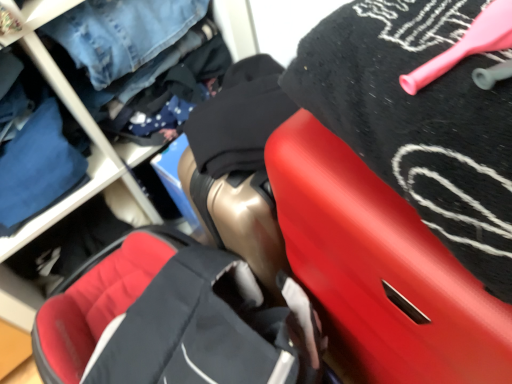
The image size is (512, 384). What do you see at coordinates (419, 120) in the screenshot?
I see `black matte towel at upper right, arranged as the 2th clothing when viewed from the left` at bounding box center [419, 120].

Image resolution: width=512 pixels, height=384 pixels. What do you see at coordinates (175, 320) in the screenshot?
I see `soft fabric baby carriage at center` at bounding box center [175, 320].

Where is `blue denim jeans at upper left, which ranks as the 1th clothing in back-to-front order`? This screenshot has width=512, height=384. blue denim jeans at upper left, which ranks as the 1th clothing in back-to-front order is located at coordinates (36, 167).

What are the coordinates of `black matte towel at upper right, which is the first clothing from right to left` in the screenshot? It's located at (419, 120).

Considering the sizes of objects rubberized red suitcase at upper right and black matte towel at upper right, which is counted as the first clothing, starting from the front, in the image provided, who is smaller, rubberized red suitcase at upper right or black matte towel at upper right, which is counted as the first clothing, starting from the front,?

With smaller size is black matte towel at upper right, which is counted as the first clothing, starting from the front.

Are rubberized red suitcase at upper right and black matte towel at upper right, which is the first clothing from right to left, far apart?

No, rubberized red suitcase at upper right is not far from black matte towel at upper right, which is the first clothing from right to left.

Which of these two, rubberized red suitcase at upper right or black matte towel at upper right, the second clothing when ordered from back to front, is wider?

Wider between the two is rubberized red suitcase at upper right.

Is rubberized red suitcase at upper right oriented towards black matte towel at upper right, which is counted as the first clothing, starting from the front?

No, rubberized red suitcase at upper right is not turned towards black matte towel at upper right, which is counted as the first clothing, starting from the front.

Between black matte towel at upper right, which is the first clothing from right to left, and blue denim jeans at upper left, which ranks as the 1th clothing in back-to-front order, which one is positioned behind?

blue denim jeans at upper left, which ranks as the 1th clothing in back-to-front order.

From the image's perspective, is black matte towel at upper right, which is the first clothing from right to left, positioned above or below blue denim jeans at upper left, the second clothing in the front-to-back sequence?

black matte towel at upper right, which is the first clothing from right to left, is situated lower than blue denim jeans at upper left, the second clothing in the front-to-back sequence, in the image.

From a real-world perspective, who is located lower, black matte towel at upper right, which is counted as the first clothing, starting from the front, or blue denim jeans at upper left, which ranks as the 1th clothing in back-to-front order?

blue denim jeans at upper left, which ranks as the 1th clothing in back-to-front order, from a real-world perspective.

Are black matte towel at upper right, which is the first clothing from right to left, and blue denim jeans at upper left, which is the 2th clothing from right to left, located far from each other?

black matte towel at upper right, which is the first clothing from right to left, is actually quite close to blue denim jeans at upper left, which is the 2th clothing from right to left.

Does blue denim jeans at upper left, which is the 2th clothing from right to left, turn towards soft fabric baby carriage at center?

No, blue denim jeans at upper left, which is the 2th clothing from right to left, is not facing towards soft fabric baby carriage at center.

In terms of width, does blue denim jeans at upper left, the second clothing in the front-to-back sequence, look wider or thinner when compared to soft fabric baby carriage at center?

Considering their sizes, blue denim jeans at upper left, the second clothing in the front-to-back sequence, looks slimmer than soft fabric baby carriage at center.

How many degrees apart are the facing directions of blue denim jeans at upper left, which ranks as the 1th clothing in back-to-front order, and soft fabric baby carriage at center?

82.2 degrees separate the facing orientations of blue denim jeans at upper left, which ranks as the 1th clothing in back-to-front order, and soft fabric baby carriage at center.

How distant is blue denim jeans at upper left, the second clothing in the front-to-back sequence, from soft fabric baby carriage at center?

A distance of 12.65 inches exists between blue denim jeans at upper left, the second clothing in the front-to-back sequence, and soft fabric baby carriage at center.

Does soft fabric baby carriage at center turn towards blue denim jeans at upper left, the second clothing in the front-to-back sequence?

No, soft fabric baby carriage at center is not facing towards blue denim jeans at upper left, the second clothing in the front-to-back sequence.

Who is smaller, soft fabric baby carriage at center or blue denim jeans at upper left, which ranks as the 1th clothing in back-to-front order?

Smaller between the two is blue denim jeans at upper left, which ranks as the 1th clothing in back-to-front order.

From the picture: Which point is more distant from viewer, [178,297] or [12,200]?

Point [12,200]

From the picture: Is rubberized red suitcase at upper right in front of or behind blue denim jeans at upper left, the second clothing in the front-to-back sequence, in the image?

Clearly, rubberized red suitcase at upper right is in front of blue denim jeans at upper left, the second clothing in the front-to-back sequence.

From the image's perspective, is rubberized red suitcase at upper right located above or below blue denim jeans at upper left, which is the 2th clothing from right to left?

rubberized red suitcase at upper right is below blue denim jeans at upper left, which is the 2th clothing from right to left.

How distant is rubberized red suitcase at upper right from blue denim jeans at upper left, which ranks as the 1th clothing in back-to-front order?

23.49 inches.

Does rubberized red suitcase at upper right have a lesser height compared to blue denim jeans at upper left, which is the 2th clothing from right to left?

No, rubberized red suitcase at upper right is not shorter than blue denim jeans at upper left, which is the 2th clothing from right to left.

From the image's perspective, between blue denim jeans at upper left, which ranks as the 1th clothing in back-to-front order, and rubberized red suitcase at upper right, who is located below?

rubberized red suitcase at upper right is shown below in the image.

Considering the points (16, 94) and (379, 309), which point is in front, point (16, 94) or point (379, 309)?

The point (379, 309) is in front.

Considering the relative sizes of blue denim jeans at upper left, the second clothing in the front-to-back sequence, and rubberized red suitcase at upper right in the image provided, is blue denim jeans at upper left, the second clothing in the front-to-back sequence, taller than rubberized red suitcase at upper right?

In fact, blue denim jeans at upper left, the second clothing in the front-to-back sequence, may be shorter than rubberized red suitcase at upper right.

Is blue denim jeans at upper left, which ranks as the 1th clothing in back-to-front order, placed right next to rubberized red suitcase at upper right?

No, blue denim jeans at upper left, which ranks as the 1th clothing in back-to-front order, is not beside rubberized red suitcase at upper right.

How different are the orientations of black matte towel at upper right, which is counted as the first clothing, starting from the front, and soft fabric baby carriage at center in degrees?

They differ by 0.000799 degrees in their facing directions.

From the image's perspective, which one is positioned lower, black matte towel at upper right, which is the first clothing from right to left, or soft fabric baby carriage at center?

soft fabric baby carriage at center appears lower in the image.

In the scene shown: Considering the positions of objects black matte towel at upper right, which is the first clothing from right to left, and soft fabric baby carriage at center in the image provided, who is more to the right, black matte towel at upper right, which is the first clothing from right to left, or soft fabric baby carriage at center?

From the viewer's perspective, black matte towel at upper right, which is the first clothing from right to left, appears more on the right side.

Relative to soft fabric baby carriage at center, is black matte towel at upper right, the second clothing when ordered from back to front, in front or behind?

black matte towel at upper right, the second clothing when ordered from back to front, is positioned closer to the viewer than soft fabric baby carriage at center.

What are the coordinates of `luggage below the black matte towel at upper right, which is counted as the first clothing, starting from the front (from the image's perspective)` in the screenshot? It's located at (379, 270).

Locate an element on the screen. This screenshot has width=512, height=384. clothing behind the black matte towel at upper right, which is the first clothing from right to left is located at coordinates pyautogui.click(x=36, y=167).

Based on their spatial positions, is rubberized red suitcase at upper right or black matte towel at upper right, which is the first clothing from right to left, further from soft fabric baby carriage at center?

Among the two, black matte towel at upper right, which is the first clothing from right to left, is located further to soft fabric baby carriage at center.

Considering their positions, is rubberized red suitcase at upper right positioned further to black matte towel at upper right, arranged as the 2th clothing when viewed from the left, than soft fabric baby carriage at center?

The object further to black matte towel at upper right, arranged as the 2th clothing when viewed from the left, is soft fabric baby carriage at center.

Which object lies further to the anchor point soft fabric baby carriage at center, black matte towel at upper right, which is the first clothing from right to left, or blue denim jeans at upper left, the second clothing in the front-to-back sequence?

Among the two, black matte towel at upper right, which is the first clothing from right to left, is located further to soft fabric baby carriage at center.

Looking at the image, which one is located closer to black matte towel at upper right, which is the first clothing from right to left, soft fabric baby carriage at center or rubberized red suitcase at upper right?

rubberized red suitcase at upper right is positioned closer to the anchor black matte towel at upper right, which is the first clothing from right to left.

Which object lies nearer to the anchor point blue denim jeans at upper left, the first clothing positioned from the left, soft fabric baby carriage at center or rubberized red suitcase at upper right?

soft fabric baby carriage at center is positioned closer to the anchor blue denim jeans at upper left, the first clothing positioned from the left.

Estimate the real-world distances between objects in this image. Which object is closer to rubberized red suitcase at upper right, soft fabric baby carriage at center or blue denim jeans at upper left, which is the 2th clothing from right to left?

soft fabric baby carriage at center is positioned closer to the anchor rubberized red suitcase at upper right.

From the picture: Estimate the real-world distances between objects in this image. Which object is further from soft fabric baby carriage at center, blue denim jeans at upper left, the second clothing in the front-to-back sequence, or black matte towel at upper right, which is the first clothing from right to left?

black matte towel at upper right, which is the first clothing from right to left, is positioned further to the anchor soft fabric baby carriage at center.

Estimate the real-world distances between objects in this image. Which object is further from rubberized red suitcase at upper right, black matte towel at upper right, which is counted as the first clothing, starting from the front, or soft fabric baby carriage at center?

soft fabric baby carriage at center lies further to rubberized red suitcase at upper right than the other object.

At what (x,y) coordinates should I click in order to perform the action: click on clothing between blue denim jeans at upper left, which ranks as the 1th clothing in back-to-front order, and rubberized red suitcase at upper right from left to right. Please return your answer as a coordinate pair (x, y). This screenshot has height=384, width=512. Looking at the image, I should click on (419, 120).

Where is `baby carriage between blue denim jeans at upper left, the second clothing in the front-to-back sequence, and rubberized red suitcase at upper right from left to right`? baby carriage between blue denim jeans at upper left, the second clothing in the front-to-back sequence, and rubberized red suitcase at upper right from left to right is located at coordinates (175, 320).

Where is `clothing situated between soft fabric baby carriage at center and rubberized red suitcase at upper right from left to right`? clothing situated between soft fabric baby carriage at center and rubberized red suitcase at upper right from left to right is located at coordinates (419, 120).

The width and height of the screenshot is (512, 384). Identify the location of baby carriage situated between blue denim jeans at upper left, which ranks as the 1th clothing in back-to-front order, and black matte towel at upper right, the second clothing when ordered from back to front, from left to right. (175, 320).